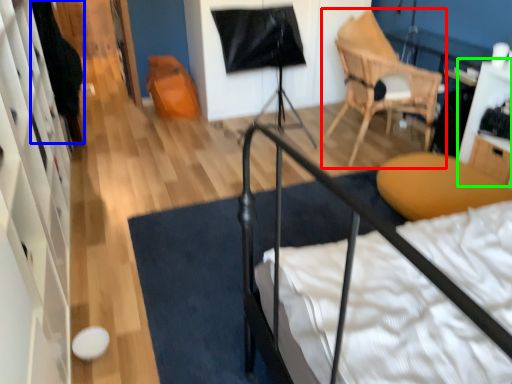
Question: Which object is positioned closest to chair (highlighted by a red box)? Select from dark (highlighted by a blue box) and table (highlighted by a green box).

Choices:
 (A) dark
 (B) table

Answer: (B)